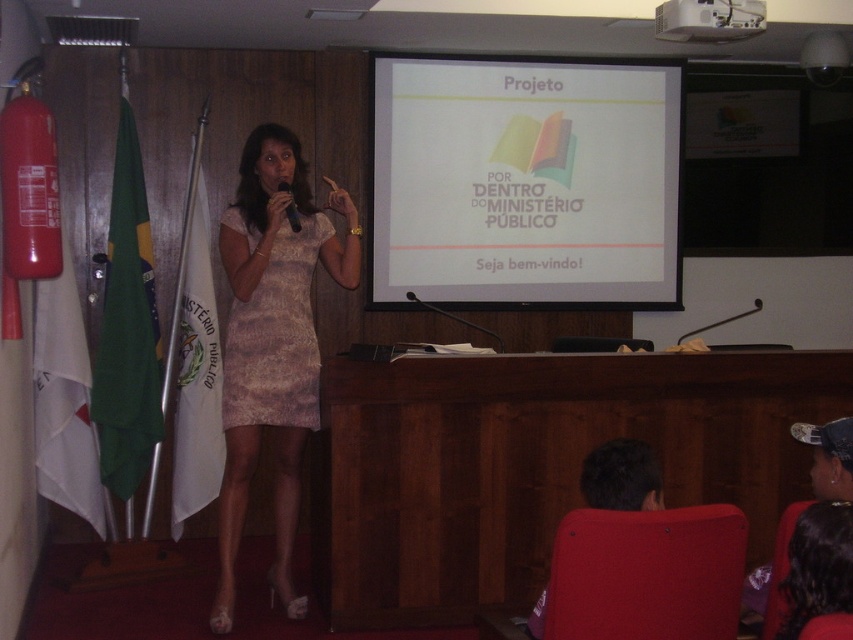
In the scene shown: You are an event planner organizing a conference. You need to ensure that the attire of the presenter matches the formal setting. Given the presence of the matte lace dress at center and metallic at upper center, which one is more appropriate for the presenter to wear?

The matte lace dress at center is more appropriate for the presenter to wear since it is larger in size than the metallic at upper center, indicating it is the proper attire for the formal event.

Consider the image. You are an attendee at the presentation. You notice the matte lace dress at center and the metallic silver microphone at upper center. Which object is positioned higher in the image?

The metallic silver microphone at upper center is positioned higher than the matte lace dress at center.